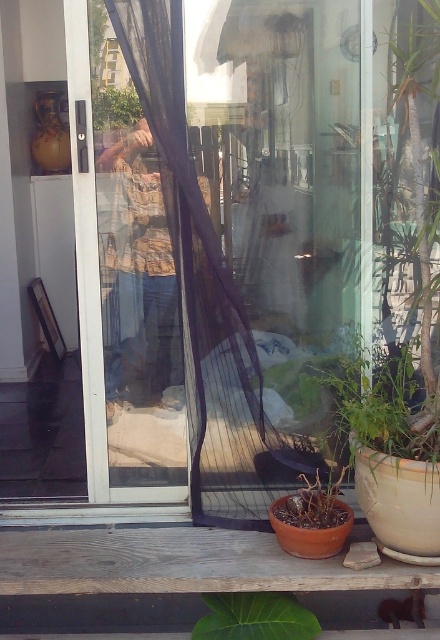
Question: Is brown matte pot at lower center to the left of green leafy plant at center from the viewer's perspective?

Choices:
 (A) no
 (B) yes

Answer: (A)

Question: Can you confirm if green leafy plant at lower center is smaller than brown matte pot at lower center?

Choices:
 (A) no
 (B) yes

Answer: (A)

Question: Which object is farther from the camera taking this photo?

Choices:
 (A) green leafy plant at lower center
 (B) green leafy plant at lower right
 (C) brown matte pot at lower center

Answer: (C)

Question: Which point appears closest to the camera in this image?

Choices:
 (A) (358, 433)
 (B) (134, 109)
 (C) (297, 506)

Answer: (A)

Question: Among these objects, which one is farthest from the camera?

Choices:
 (A) brown matte pot at lower center
 (B) green leafy plant at lower center
 (C) green leafy plant at lower right

Answer: (A)

Question: Can you confirm if brown matte pot at lower center is positioned to the right of green leafy plant at center?

Choices:
 (A) no
 (B) yes

Answer: (B)